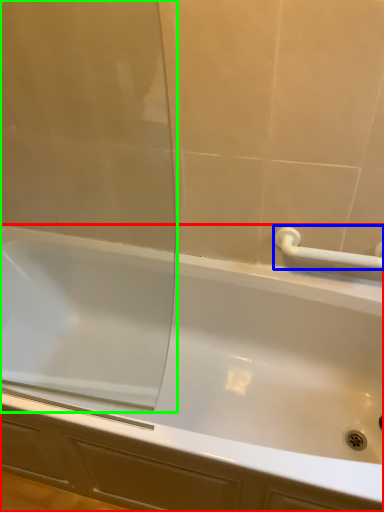
Question: Based on their relative distances, which object is farther from bathtub (highlighted by a red box)? Choose from towel bar (highlighted by a blue box) and screen door (highlighted by a green box).

Choices:
 (A) towel bar
 (B) screen door

Answer: (A)